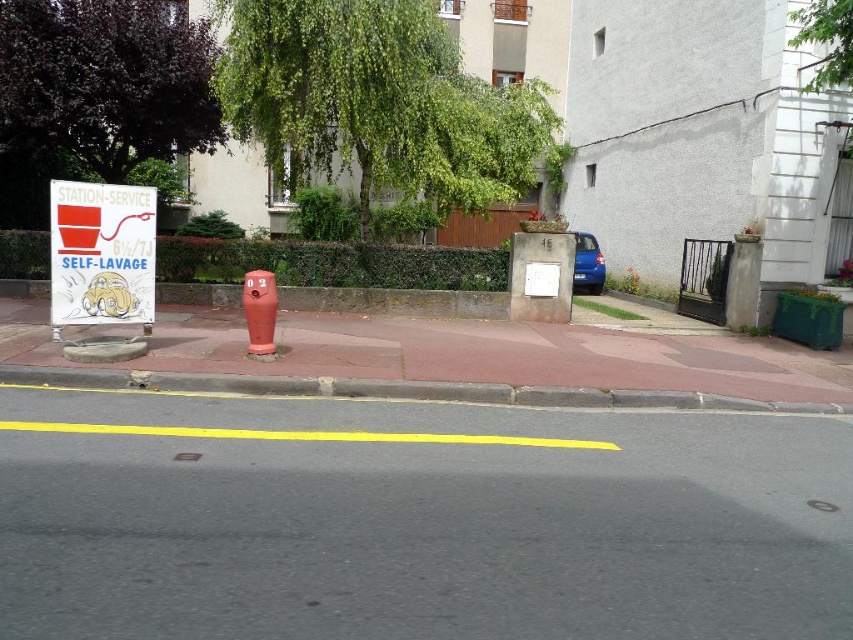
Question: Which point is farther to the camera?

Choices:
 (A) concrete at center
 (B) red plastic sign at left
 (C) matte red hydrant at center

Answer: (C)

Question: Can you confirm if concrete at center is wider than matte red hydrant at center?

Choices:
 (A) yes
 (B) no

Answer: (A)

Question: Is concrete at center to the left of red plastic sign at left from the viewer's perspective?

Choices:
 (A) yes
 (B) no

Answer: (B)

Question: Which of the following is the farthest from the observer?

Choices:
 (A) (141, 384)
 (B) (265, 300)
 (C) (132, 269)

Answer: (C)

Question: Which point appears farthest from the camera in this image?

Choices:
 (A) (96, 282)
 (B) (695, 394)
 (C) (265, 294)

Answer: (C)

Question: Where is concrete at center located in relation to red plastic sign at left in the image?

Choices:
 (A) left
 (B) right

Answer: (B)